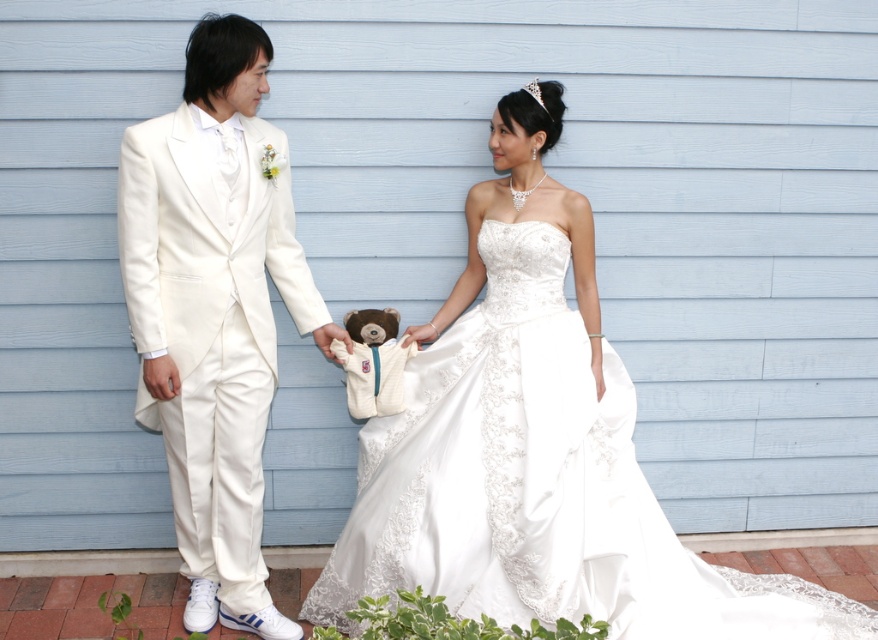
Consider the image. You are standing in the wedding scene and want to place a decoration between the two points, point [364,458] and point [169,192]. Which point should the decoration be closer to in order to be closer to the viewer?

The decoration should be closer to point [364,458] because it is closer to the viewer than point [169,192].